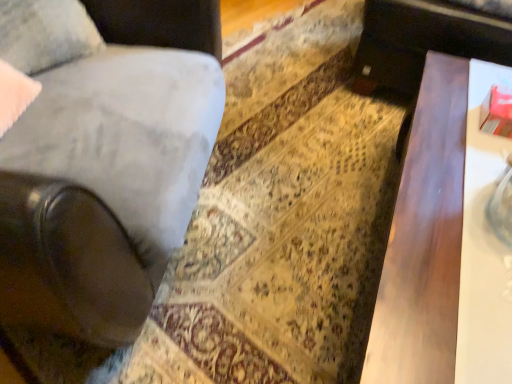
Question: Does dark wood table at right have a lesser height compared to velvet gray pillow at upper left?

Choices:
 (A) yes
 (B) no

Answer: (B)

Question: Is dark wood table at right taller than velvet gray pillow at upper left?

Choices:
 (A) yes
 (B) no

Answer: (A)

Question: Is dark wood table at right directly adjacent to velvet gray pillow at upper left?

Choices:
 (A) yes
 (B) no

Answer: (B)

Question: Is velvet gray pillow at upper left at the back of dark wood table at right?

Choices:
 (A) no
 (B) yes

Answer: (A)

Question: Is dark wood table at right closer to camera compared to velvet gray pillow at upper left?

Choices:
 (A) yes
 (B) no

Answer: (A)

Question: From a real-world perspective, is dark wood table at right located beneath velvet gray pillow at upper left?

Choices:
 (A) yes
 (B) no

Answer: (A)

Question: Considering the relative positions of dark wood table at right and suede-like gray chair at left in the image provided, is dark wood table at right behind suede-like gray chair at left?

Choices:
 (A) yes
 (B) no

Answer: (A)

Question: Considering the relative sizes of dark wood table at right and suede-like gray chair at left in the image provided, is dark wood table at right bigger than suede-like gray chair at left?

Choices:
 (A) yes
 (B) no

Answer: (B)

Question: Is dark wood table at right thinner than suede-like gray chair at left?

Choices:
 (A) no
 (B) yes

Answer: (B)

Question: Is dark wood table at right not inside suede-like gray chair at left?

Choices:
 (A) no
 (B) yes

Answer: (B)

Question: Is suede-like gray chair at left a part of dark wood table at right?

Choices:
 (A) yes
 (B) no

Answer: (B)

Question: Is dark wood table at right oriented towards suede-like gray chair at left?

Choices:
 (A) no
 (B) yes

Answer: (A)

Question: Is velvet gray pillow at upper left located outside dark wood table at right?

Choices:
 (A) yes
 (B) no

Answer: (A)